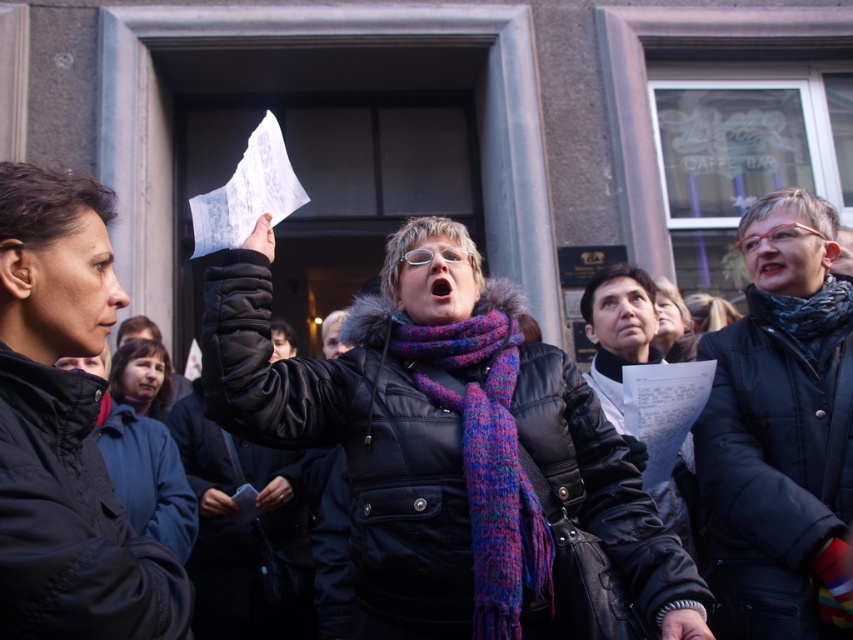
You are organizing a photo shoot and need to ensure that the purple knitted scarf at center and the black matte jacket at upper right are visible in the same frame. Given their distance apart, what is the minimum focal length your camera lens should have to capture both objects without distortion?

The purple knitted scarf at center and black matte jacket at upper right are 3.41 meters apart. To capture both in the same frame without distortion, the camera lens should have a focal length of at least 35mm, as wider lenses can accommodate larger distances between subjects.

You are a photographer trying to capture a clear shot of the purple knitted scarf at center and the matte black jacket at left. Since the camera can only focus on one object at a time, which object should you focus on first if you want to ensure the scarf is visible in the final photo?

The purple knitted scarf at center is positioned under the matte black jacket at left. To ensure the scarf is visible, focus on the matte black jacket at left first, then adjust focus to the purple knitted scarf at center to capture both layers properly.

You are standing at the point labeled point at (495,504) and want to walk to the building entrance which is 9 meters away. Is the building entrance located in the direction of the Caff Bar sign or away from it?

The building entrance is located in the direction of the Caff Bar sign because the point at (495,504) is 9.00 meters away from it.